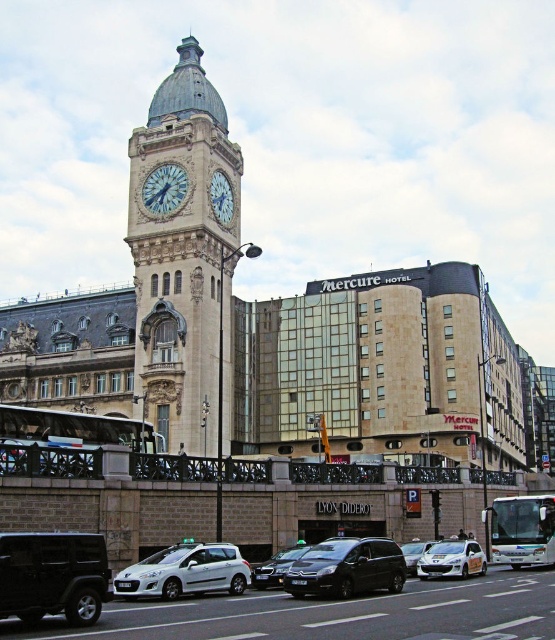
Question: Does polished bronze clock tower at center-left appear over white glossy clock at center?

Choices:
 (A) no
 (B) yes

Answer: (A)

Question: Which point is farther to the camera?

Choices:
 (A) (296, 582)
 (B) (160, 580)

Answer: (B)

Question: Observing the image, what is the correct spatial positioning of shiny black van at center in reference to white painted metal clock at upper center?

Choices:
 (A) left
 (B) right

Answer: (B)

Question: Observing the image, what is the correct spatial positioning of silver metallic hatchback at center in reference to silver metallic sedan at center?

Choices:
 (A) below
 (B) above

Answer: (B)

Question: Which point is farther to the camera?

Choices:
 (A) metallic silver sedan at center
 (B) white glossy clock at center
 (C) silver metallic hatchback at lower right

Answer: (B)

Question: Which point is closer to the camera taking this photo?

Choices:
 (A) (360, 547)
 (B) (222, 176)
 (C) (420, 552)

Answer: (A)